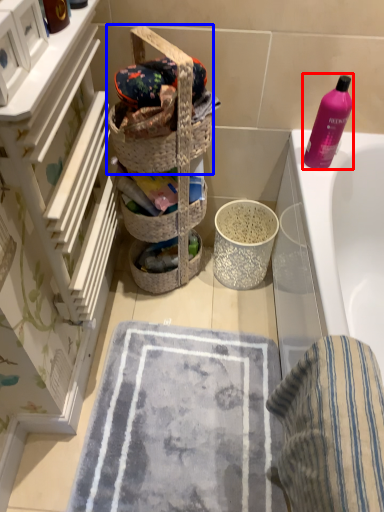
Question: Which of the following is the closest to the observer, cleaning product (highlighted by a red box) or picnic basket (highlighted by a blue box)?

Choices:
 (A) cleaning product
 (B) picnic basket

Answer: (B)